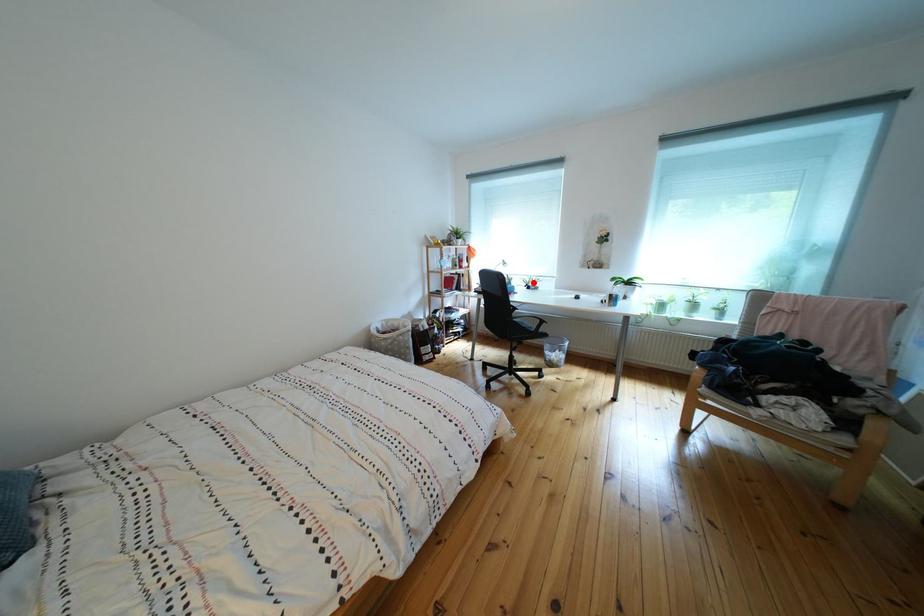
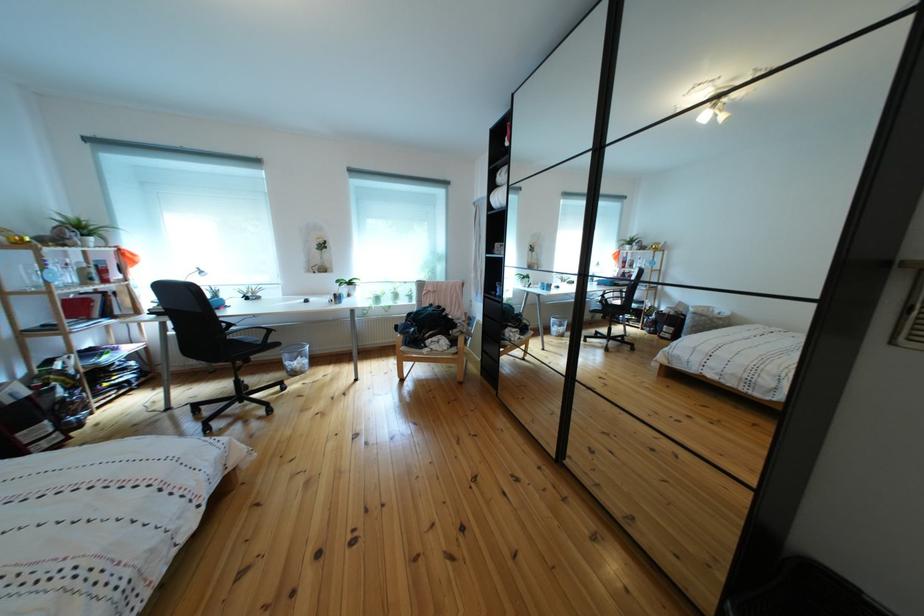
Where in the second image is the point corresponding to the highlighted location from the first image?

(247, 293)